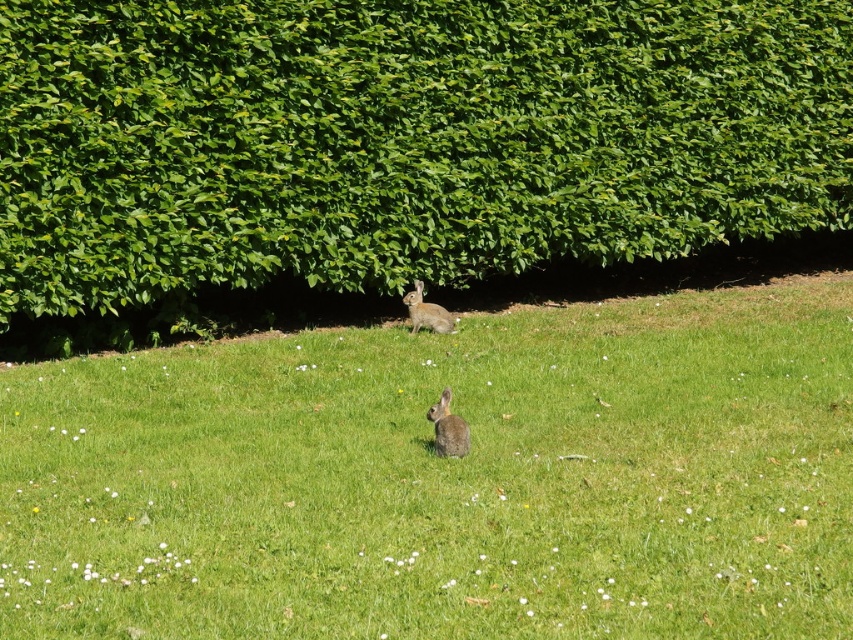
Based on the photo, you are a gardener who wants to plant a new flower bed between the green grassy at center and the green leafy hedge at center. The flower bed requires a minimum of 5 meters of space. Is there enough space available?

The distance between the green grassy at center and the green leafy hedge at center is 5.34 meters, which is more than the required 5 meters. Therefore, there is sufficient space to plant the flower bed.

Looking at this image, you are a photographer standing in the scene and want to take a photo of both the green grassy at center and the green leafy hedge at center. Which one will appear larger in the photo?

The green grassy at center will appear larger in the photo because it is closer to the viewer than the green leafy hedge at center.

Looking at this image, you are observing two rabbits in a grassy area. Which rabbit is positioned lower in the scene, the furry brown rabbit at center or the fuzzy brown rabbit at center?

The furry brown rabbit at center is positioned lower than the fuzzy brown rabbit at center.